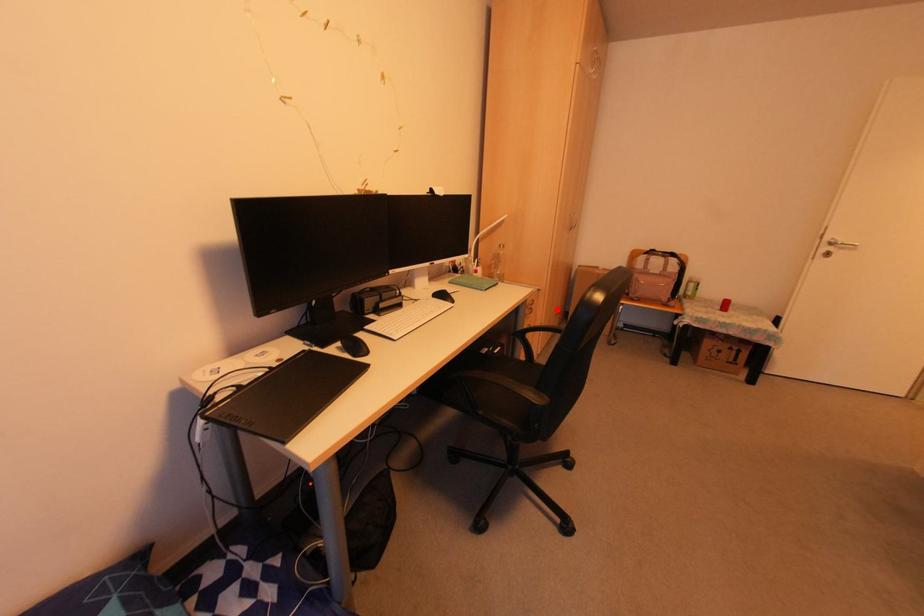
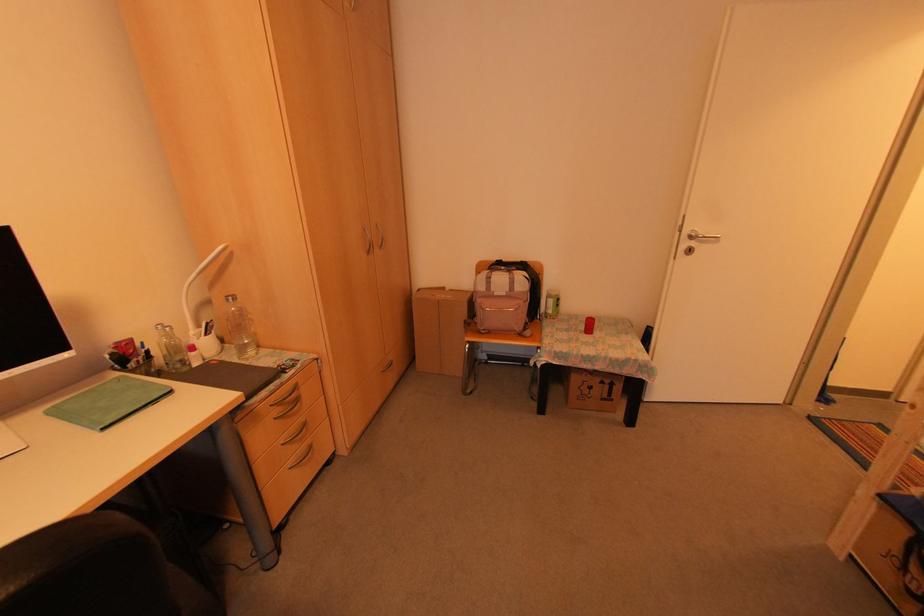
In the second image, find the point that corresponds to the highlighted location in the first image.

(388, 359)